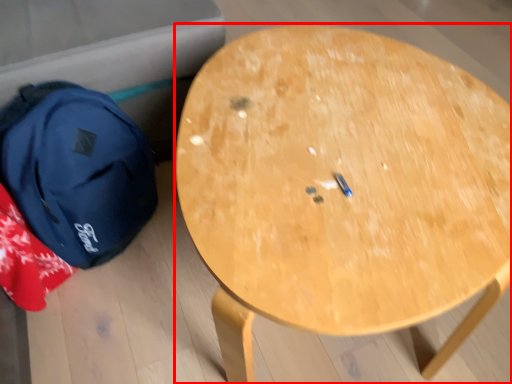
Question: From the image's perspective, where is table (annotated by the red box) located relative to backpack?

Choices:
 (A) above
 (B) below

Answer: (B)